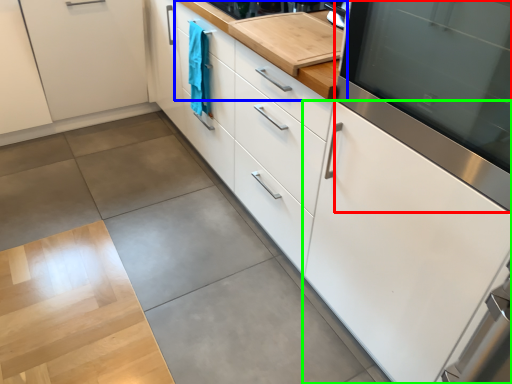
Question: Based on their relative distances, which object is farther from home appliance (highlighted by a red box)? Choose from countertop (highlighted by a blue box) and cabinetry (highlighted by a green box).

Choices:
 (A) countertop
 (B) cabinetry

Answer: (A)